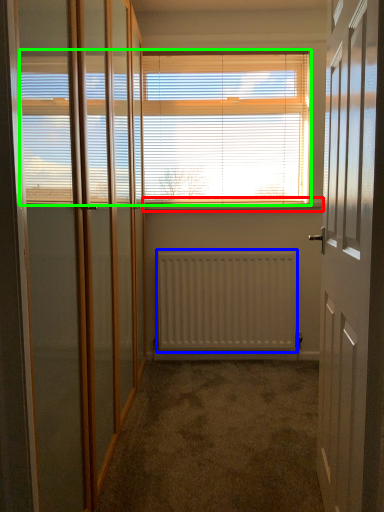
Question: Considering the real-world distances, which object is closest to window sill (highlighted by a red box)? radiator (highlighted by a blue box) or window blind (highlighted by a green box).

Choices:
 (A) radiator
 (B) window blind

Answer: (B)